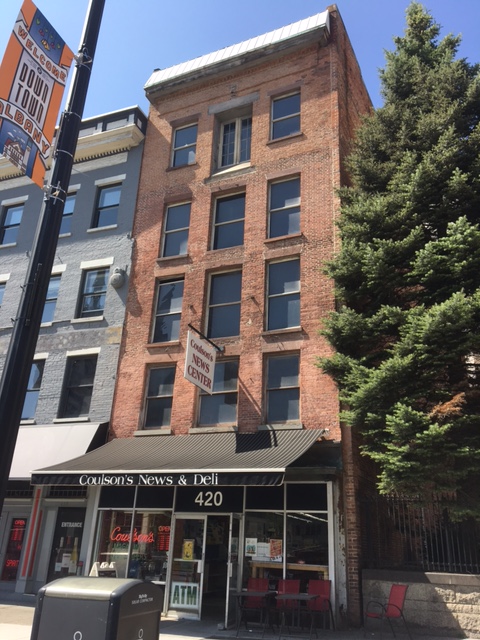
What are the coordinates of `welcome sign` in the screenshot? It's located at (26, 48).